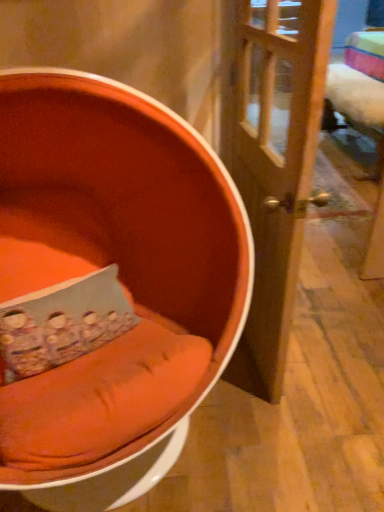
Question: Looking at their shapes, would you say orange fabric chair at left is wider or thinner than wooden door at center?

Choices:
 (A) wide
 (B) thin

Answer: (A)

Question: From the image's perspective, relative to wooden door at center, is orange fabric chair at left above or below?

Choices:
 (A) above
 (B) below

Answer: (B)

Question: Which object is the farthest from the orange fabric chair at left?

Choices:
 (A) floral fabric pillow at center
 (B) wooden door at center

Answer: (B)

Question: Which object is positioned closest to the orange fabric chair at left?

Choices:
 (A) floral fabric pillow at center
 (B) wooden door at center

Answer: (A)